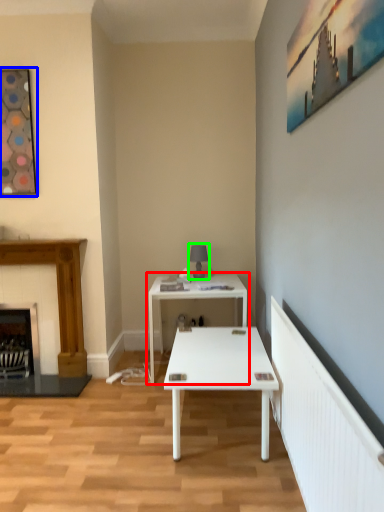
Question: Which object is positioned farthest from table (highlighted by a red box)? Select from picture frame (highlighted by a blue box) and table lamp (highlighted by a green box).

Choices:
 (A) picture frame
 (B) table lamp

Answer: (A)